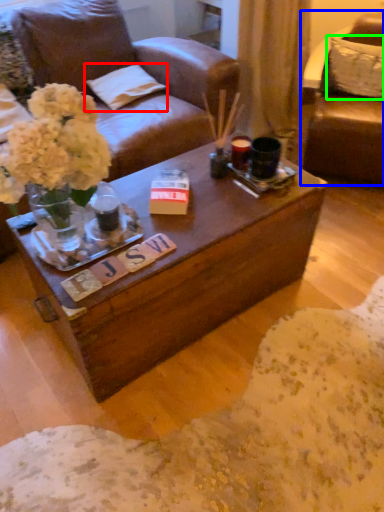
Question: Estimate the real-world distances between objects in this image. Which object is farther from pillow (highlighted by a red box), chair (highlighted by a blue box) or pillow (highlighted by a green box)?

Choices:
 (A) chair
 (B) pillow

Answer: (B)